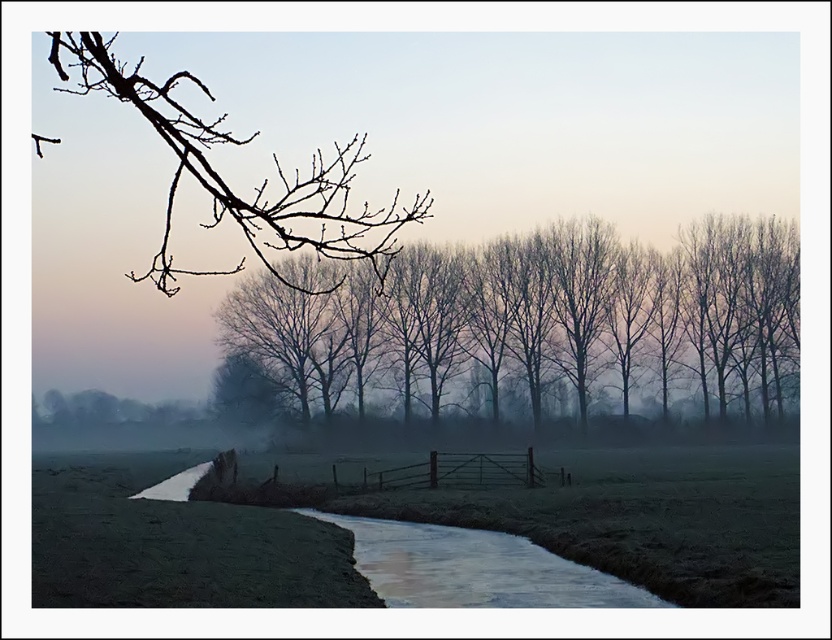
Question: Which of the following is the closest to the observer?

Choices:
 (A) silvery branches at center
 (B) bare branches at upper left

Answer: (B)

Question: Is silvery branches at center smaller than metallic gate at center?

Choices:
 (A) yes
 (B) no

Answer: (B)

Question: Can you confirm if silvery branches at center is positioned to the left of metallic gate at center?

Choices:
 (A) no
 (B) yes

Answer: (A)

Question: Is silvery branches at center closer to camera compared to metallic gate at center?

Choices:
 (A) no
 (B) yes

Answer: (A)

Question: Which object is closer to the camera taking this photo?

Choices:
 (A) silvery branches at center
 (B) bare branches at upper left
 (C) metallic gate at center

Answer: (B)

Question: Which point is closer to the camera?

Choices:
 (A) (324, 214)
 (B) (726, 336)
 (C) (337, 490)

Answer: (A)